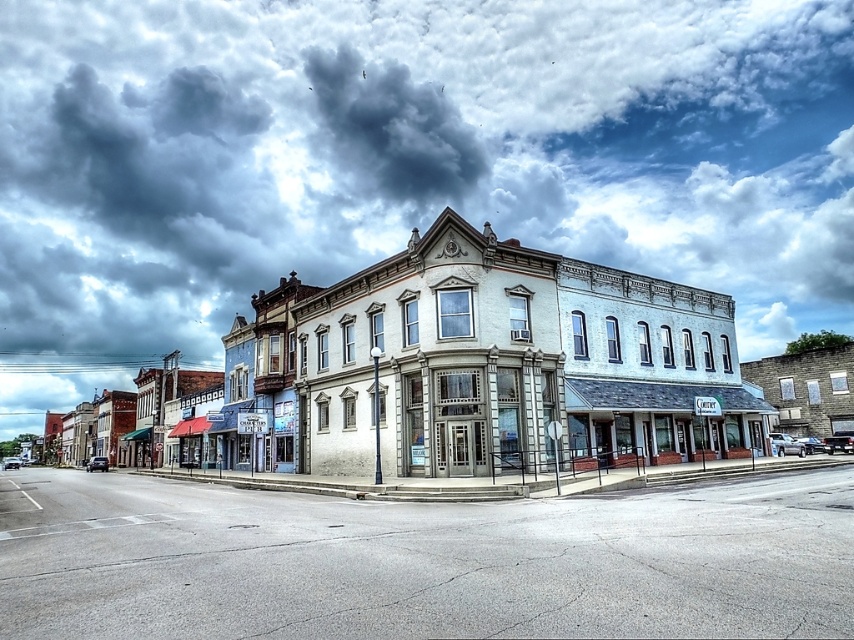
Between gray asphalt at center and white stone building at center, which one is positioned lower?

white stone building at center is lower down.

What do you see at coordinates (423, 563) in the screenshot?
I see `gray asphalt at center` at bounding box center [423, 563].

Identify the location of gray asphalt at center. (423, 563).

Does cloudy sky at upper center have a greater height compared to gray asphalt at center?

Correct, cloudy sky at upper center is much taller as gray asphalt at center.

Is point (648, 168) farther from camera compared to point (218, 497)?

Yes, it is.

Which is in front, point (0, 401) or point (811, 624)?

Point (811, 624)

Where is `cloudy sky at upper center`? cloudy sky at upper center is located at coordinates (402, 160).

From the picture: Is cloudy sky at upper center below white stone building at center?

No.

Which is more to the right, cloudy sky at upper center or white stone building at center?

cloudy sky at upper center is more to the right.

Does point (764, 83) come farther from viewer compared to point (294, 419)?

Yes, point (764, 83) is farther from viewer.

Where is `cloudy sky at upper center`? The image size is (854, 640). cloudy sky at upper center is located at coordinates (402, 160).